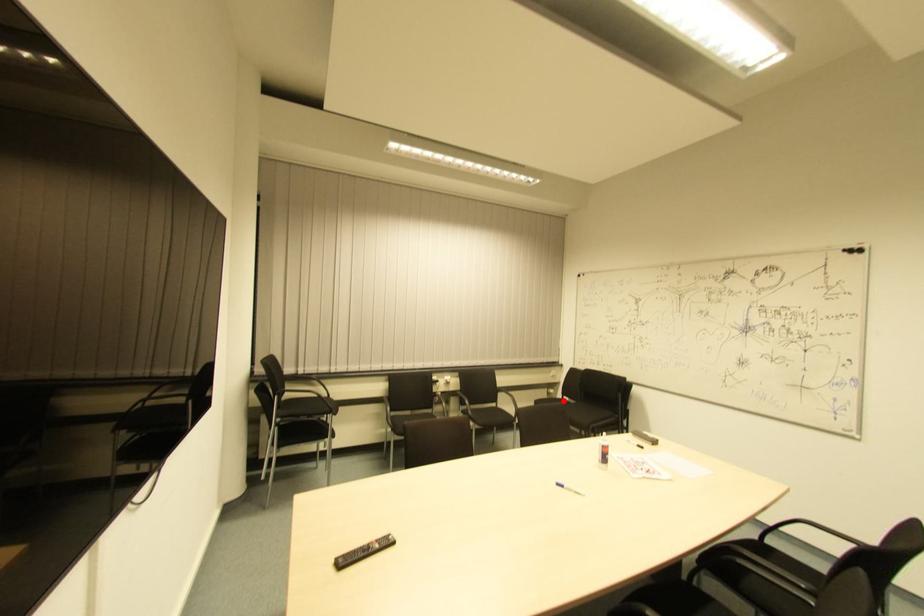
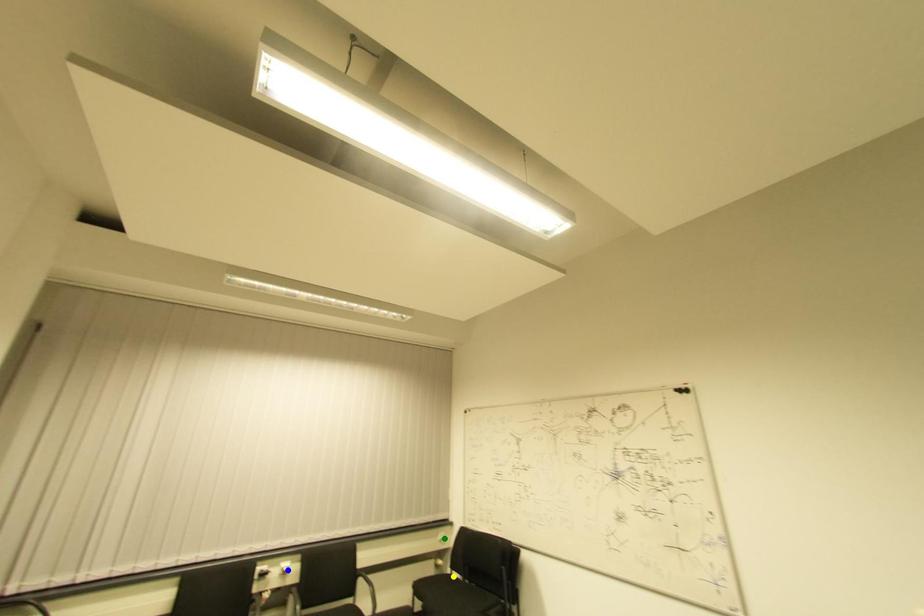
Question: I am providing you with two images of the same scene from different viewpoints. A red point is marked on the first image. You are given multiple points on the second image. Which spot in image 2 lines up with the point in image 1?

Choices:
 (A) green point
 (B) blue point
 (C) yellow point

Answer: (C)